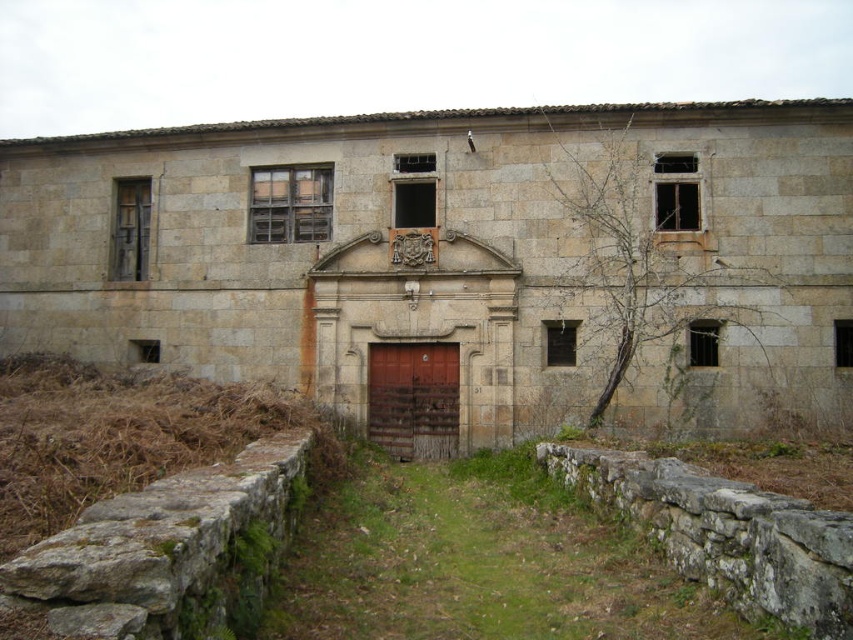
Does brown grassy hay at lower left have a lesser height compared to rusty metal door at center?

No, brown grassy hay at lower left is not shorter than rusty metal door at center.

Who is shorter, brown grassy hay at lower left or rusty metal door at center?

With less height is rusty metal door at center.

Who is more distant from viewer, (216, 460) or (402, 445)?

The point (402, 445) is more distant.

The image size is (853, 640). I want to click on brown grassy hay at lower left, so click(x=126, y=436).